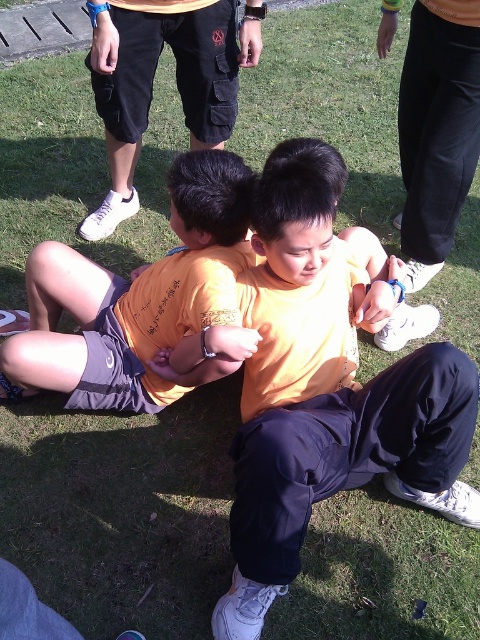
Does orange matte shirt at center appear on the right side of matte black shorts at upper center?

Correct, you'll find orange matte shirt at center to the right of matte black shorts at upper center.

Is orange matte shirt at center smaller than matte black shorts at upper center?

Correct, orange matte shirt at center occupies less space than matte black shorts at upper center.

Image resolution: width=480 pixels, height=640 pixels. Identify the location of orange matte shirt at center. tap(144, 305).